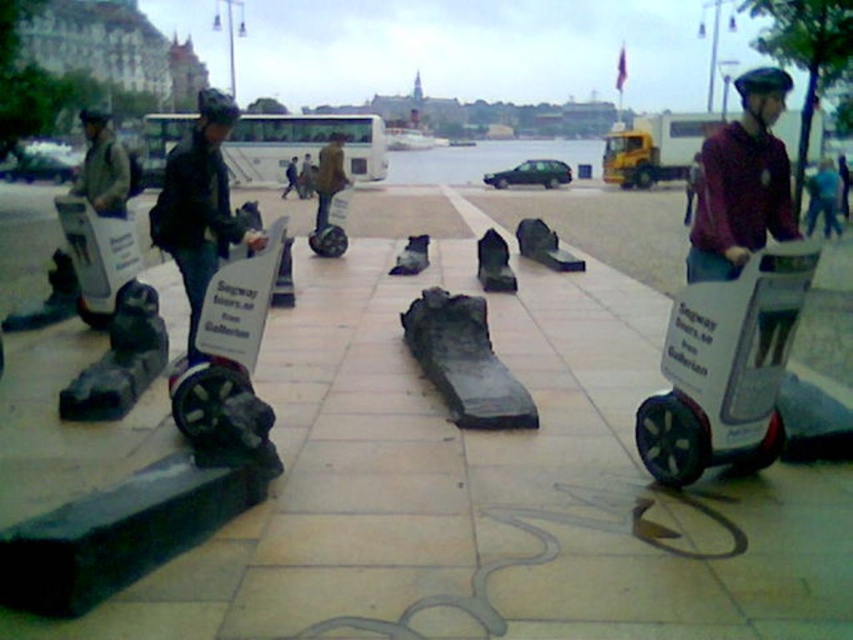
You are a photographer standing at the edge of the pavement. You want to take a photo of the matte black segway at center and the purple matte helmet at upper right. Which object should you adjust your camera to focus on first if you want to capture both in the same frame?

The matte black segway at center is to the left of the purple matte helmet at upper right, so you should focus on the matte black segway at center first as it is closer to the left side of the frame.

You are a delivery person who needs to place a package on the smooth concrete slabs at center. However, there is a blue fabric helmet at upper right in the way. Can you place the package directly on the slabs without moving the helmet?

The smooth concrete slabs at center is positioned under the blue fabric helmet at upper right, so the helmet is above the slabs. To place the package directly on the slabs, you would need to move the helmet out of the way first.